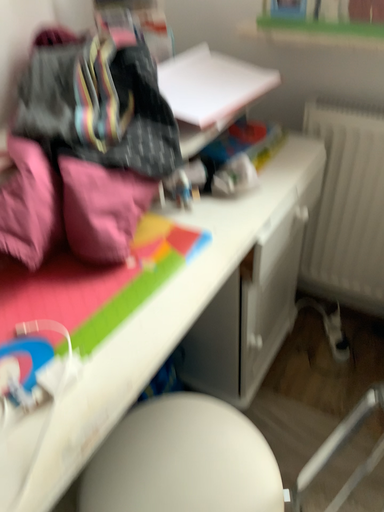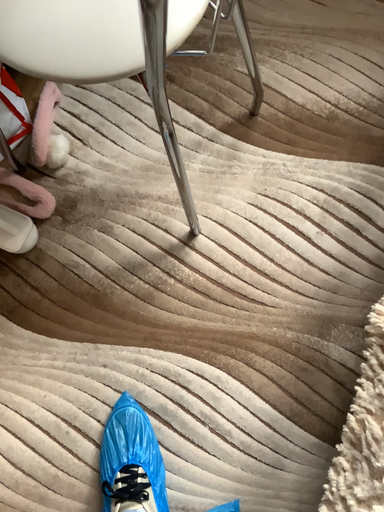
Question: How did the camera likely rotate when shooting the video?

Choices:
 (A) rotated left
 (B) rotated right

Answer: (B)